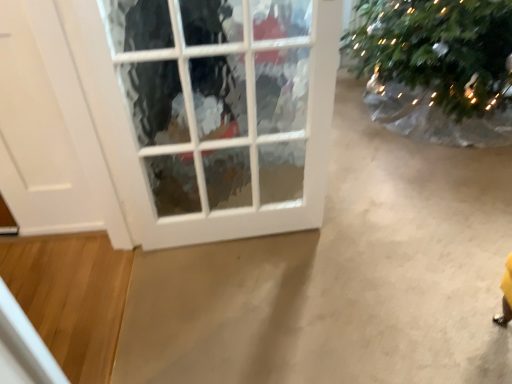
Question: Is white glass window at center facing away from green textured christmas tree at upper right?

Choices:
 (A) no
 (B) yes

Answer: (B)

Question: Considering the relative positions of white glass window at center and green textured christmas tree at upper right in the image provided, is white glass window at center in front of green textured christmas tree at upper right?

Choices:
 (A) no
 (B) yes

Answer: (B)

Question: Is white glass window at center at the right side of green textured christmas tree at upper right?

Choices:
 (A) no
 (B) yes

Answer: (A)

Question: From the image's perspective, does white glass window at center appear higher than green textured christmas tree at upper right?

Choices:
 (A) yes
 (B) no

Answer: (B)

Question: Can you confirm if white glass window at center is positioned to the left of green textured christmas tree at upper right?

Choices:
 (A) yes
 (B) no

Answer: (A)

Question: Is white matte door at left taller or shorter than green textured christmas tree at upper right?

Choices:
 (A) tall
 (B) short

Answer: (A)

Question: Considering their positions, is white matte door at left located in front of or behind green textured christmas tree at upper right?

Choices:
 (A) front
 (B) behind

Answer: (A)

Question: Is white matte door at left spatially inside green textured christmas tree at upper right, or outside of it?

Choices:
 (A) inside
 (B) outside

Answer: (B)

Question: From the image's perspective, is white matte door at left above or below green textured christmas tree at upper right?

Choices:
 (A) below
 (B) above

Answer: (A)

Question: In terms of width, does white glass window at center look wider or thinner when compared to green textured christmas tree at upper right?

Choices:
 (A) wide
 (B) thin

Answer: (A)

Question: Is white glass window at center in front of or behind green textured christmas tree at upper right in the image?

Choices:
 (A) front
 (B) behind

Answer: (A)

Question: Is point (124, 205) positioned closer to the camera than point (386, 11)?

Choices:
 (A) closer
 (B) farther

Answer: (A)

Question: Is white glass window at center bigger or smaller than green textured christmas tree at upper right?

Choices:
 (A) small
 (B) big

Answer: (B)

Question: Choose the correct answer: Is white matte door at left inside white glass window at center or outside it?

Choices:
 (A) outside
 (B) inside

Answer: (A)

Question: Considering the positions of white matte door at left and white glass window at center in the image, is white matte door at left bigger or smaller than white glass window at center?

Choices:
 (A) small
 (B) big

Answer: (A)